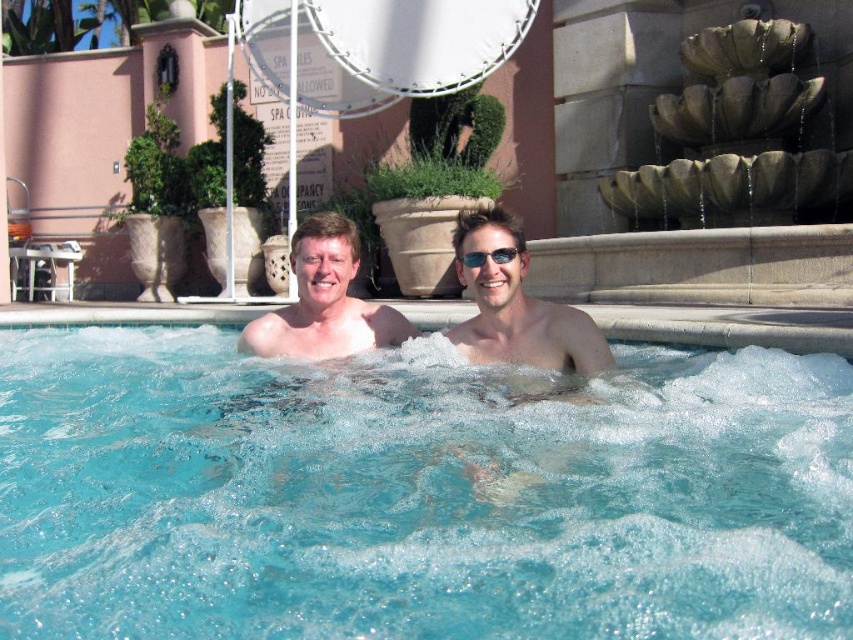
Question: Can you confirm if matte skin at center is positioned to the left of smooth skin man at center?

Choices:
 (A) yes
 (B) no

Answer: (B)

Question: Does smooth skin man at center appear on the right side of sunglasses at center?

Choices:
 (A) no
 (B) yes

Answer: (A)

Question: Does clear blue water at center have a larger size compared to matte skin at center?

Choices:
 (A) no
 (B) yes

Answer: (B)

Question: Which object is closer to the camera taking this photo?

Choices:
 (A) matte skin at center
 (B) smooth skin man at center
 (C) clear blue water at center
 (D) sunglasses at center

Answer: (C)

Question: Which object is the farthest from the matte skin at center?

Choices:
 (A) smooth skin man at center
 (B) clear blue water at center
 (C) sunglasses at center

Answer: (B)

Question: Which is farther from the smooth skin man at center?

Choices:
 (A) matte skin at center
 (B) sunglasses at center

Answer: (A)